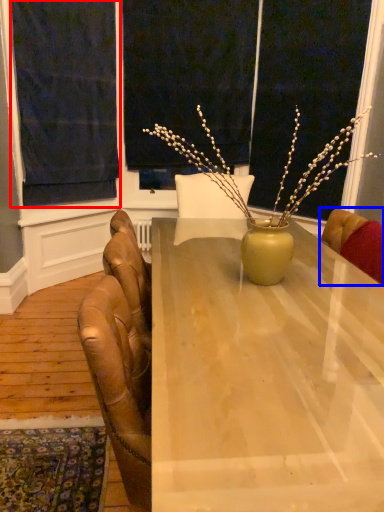
Question: Which of the following is the farthest to the observer, curtain (highlighted by a red box) or chair (highlighted by a blue box)?

Choices:
 (A) curtain
 (B) chair

Answer: (A)